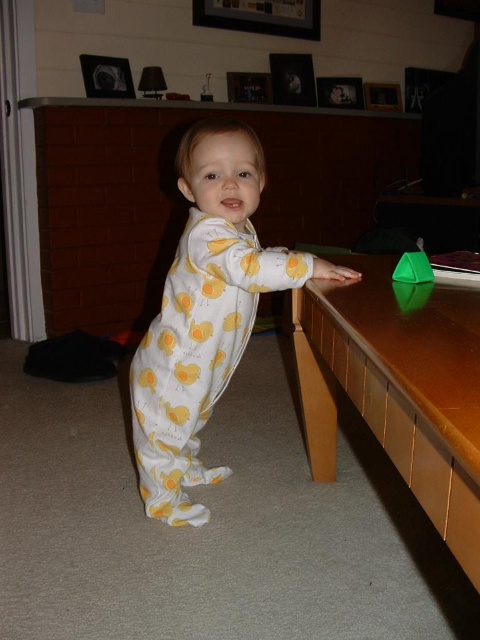
Is brown wooden table at right smaller than green plastic toy at right?

No.

Which is more to the left, brown wooden table at right or green plastic toy at right?

brown wooden table at right is more to the left.

Image resolution: width=480 pixels, height=640 pixels. Find the location of `brown wooden table at right`. brown wooden table at right is located at coordinates (397, 387).

The height and width of the screenshot is (640, 480). Find the location of `brown wooden table at right`. brown wooden table at right is located at coordinates (397, 387).

Is the position of white/yellow duck print jumpsuit at center less distant than that of green plastic toy at right?

Yes.

Can you confirm if white/yellow duck print jumpsuit at center is thinner than green plastic toy at right?

No.

Is point (277, 273) less distant than point (404, 266)?

Yes, point (277, 273) is closer to viewer.

This screenshot has width=480, height=640. What are the coordinates of `white/yellow duck print jumpsuit at center` in the screenshot? It's located at (197, 355).

Is brown wooden table at right shorter than white/yellow duck print jumpsuit at center?

Correct, brown wooden table at right is not as tall as white/yellow duck print jumpsuit at center.

The height and width of the screenshot is (640, 480). Identify the location of brown wooden table at right. (397, 387).

Is point (336, 320) positioned behind point (179, 433)?

No, it is in front of (179, 433).

Locate an element on the screen. Image resolution: width=480 pixels, height=640 pixels. brown wooden table at right is located at coordinates (397, 387).